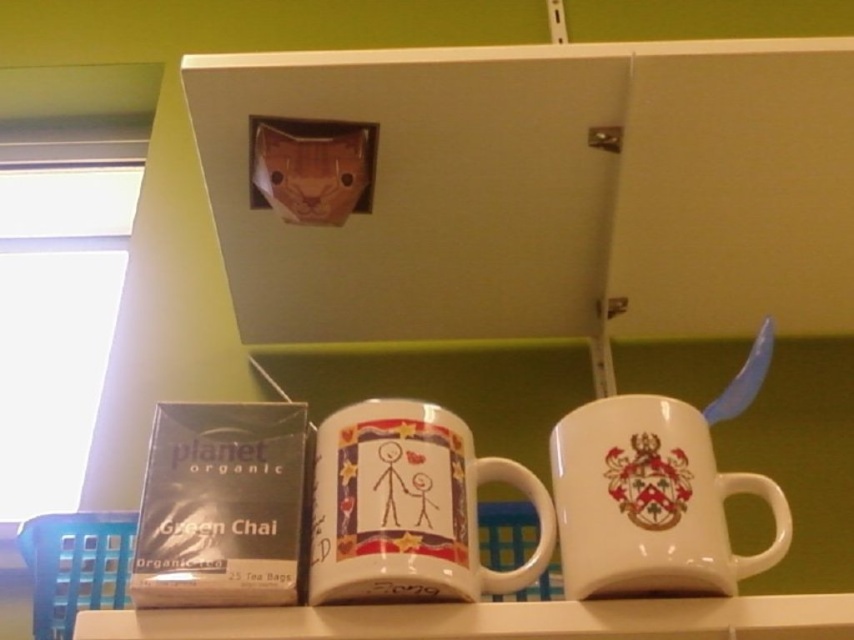
You are a delivery person placing a new mug that is 3 inches tall onto the white glossy shelf at lower center. The current white ceramic mug at center is already on the shelf. Can the new mug fit on the shelf without overlapping the existing mug?

The distance between the white ceramic mug at center and the white glossy shelf at lower center is 3.89 inches. Since the new mug is 3 inches tall, it can fit on the shelf without overlapping the existing mug as there is enough space.